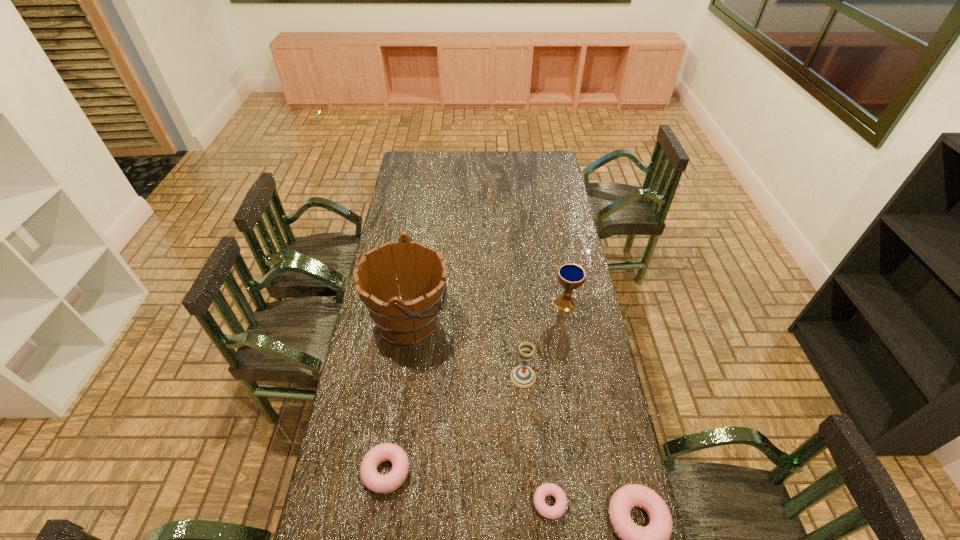
The image size is (960, 540). Identify the location of doughnut that is the closest to the farther chalice. (554, 512).

I want to click on free region that satisfies the following two spatial constraints: 1. with the handle on the wine bucket; 2. on the left side of the second doughnut from left to right, so click(x=384, y=503).

At what (x,y) coordinates should I click in order to perform the action: click on free space that satisfies the following two spatial constraints: 1. with the handle on the third farthest object; 2. on the right side of the wine bucket. Please return your answer as a coordinate pair (x, y). The image size is (960, 540). Looking at the image, I should click on (401, 376).